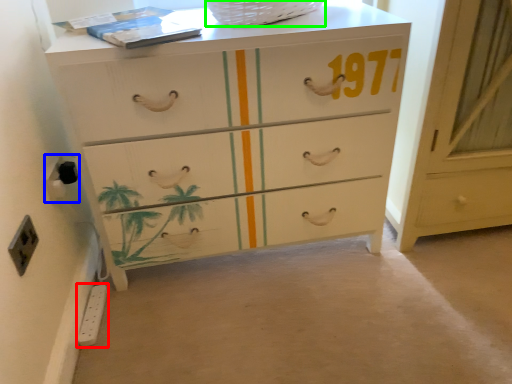
Question: Which object is the farthest from electric outlet (highlighted by a red box)? Choose among these: electric outlet (highlighted by a blue box) or basket (highlighted by a green box).

Choices:
 (A) electric outlet
 (B) basket

Answer: (B)